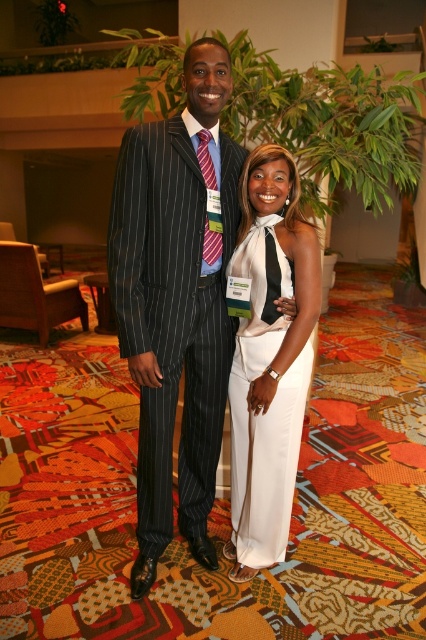
Question: Is pinstriped suit at center positioned in front of white satin dress at center?

Choices:
 (A) yes
 (B) no

Answer: (A)

Question: Among these points, which one is farthest from the camera?

Choices:
 (A) (290, 371)
 (B) (147, 330)

Answer: (A)

Question: Does pinstriped suit at center lie behind white satin dress at center?

Choices:
 (A) yes
 (B) no

Answer: (B)

Question: Among these points, which one is nearest to the camera?

Choices:
 (A) (259, 372)
 (B) (198, 515)

Answer: (A)

Question: In this image, where is pinstriped suit at center located relative to white satin dress at center?

Choices:
 (A) left
 (B) right

Answer: (A)